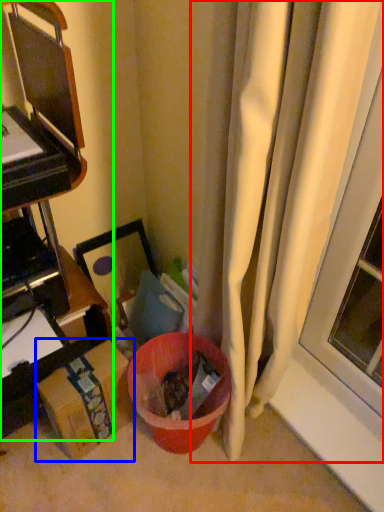
Question: Considering the real-world distances, which object is closest to curtain (highlighted by a red box)? cardboard box (highlighted by a blue box) or furniture (highlighted by a green box).

Choices:
 (A) cardboard box
 (B) furniture

Answer: (B)